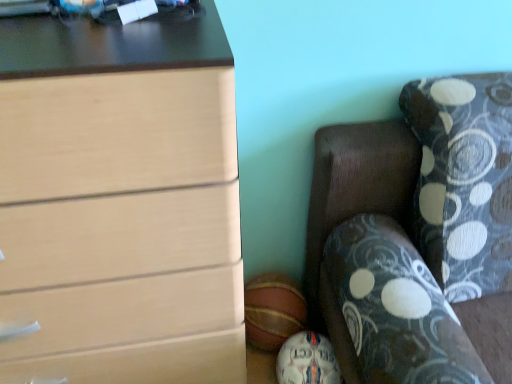
Question: Looking at the image, does white leather soccer ball at lower center, the 2th sports equipment viewed from the top, seem bigger or smaller compared to rubber basketball at lower center, which is the 2th sports equipment from bottom to top?

Choices:
 (A) small
 (B) big

Answer: (A)

Question: Is white leather soccer ball at lower center, the 2th sports equipment viewed from the top, inside or outside of rubber basketball at lower center, which is the 2th sports equipment from bottom to top?

Choices:
 (A) outside
 (B) inside

Answer: (A)

Question: Which of these objects is positioned closest to the rubber basketball at lower center, which is the 2th sports equipment from bottom to top?

Choices:
 (A) white leather soccer ball at lower center, the 1th sports equipment when ordered from bottom to top
 (B) matte wood chest of drawers at left
 (C) dark wood couch at lower right

Answer: (A)

Question: Considering the real-world distances, which object is closest to the matte wood chest of drawers at left?

Choices:
 (A) dark wood couch at lower right
 (B) white leather soccer ball at lower center, the 2th sports equipment viewed from the top
 (C) rubber basketball at lower center, which is the 2th sports equipment from bottom to top

Answer: (A)